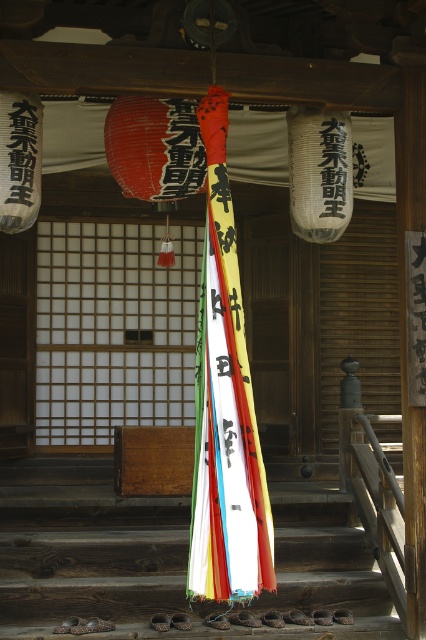
You are standing in front of the entrance to the temple or shrine shown in the image. You notice a white paper lantern at upper left. Can you determine its exact position in terms of coordinates?

The white paper lantern at upper left is located at coordinates [20,160].